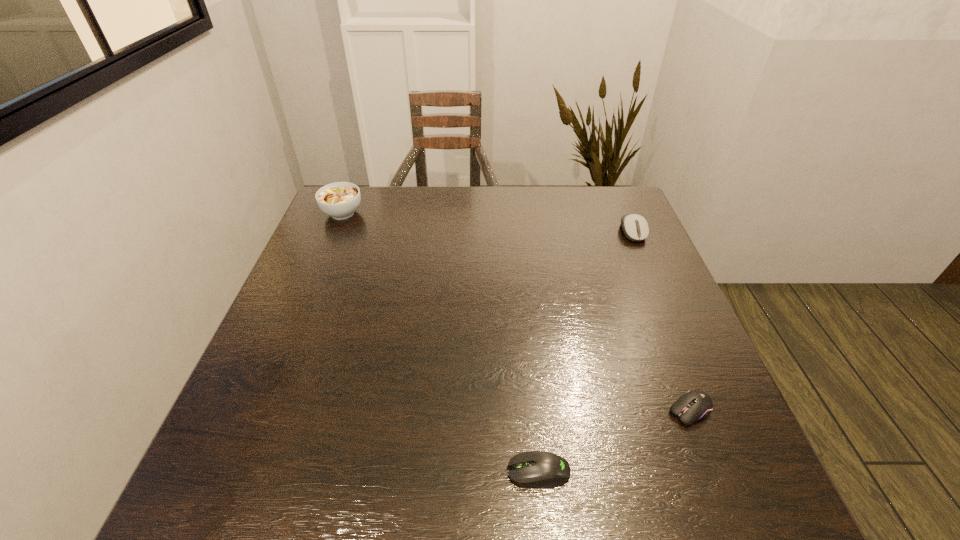
Where is `the tallest object`? the tallest object is located at coordinates (340, 200).

The height and width of the screenshot is (540, 960). Identify the location of the leftmost object. (340, 200).

You are a GUI agent. You are given a task and a screenshot of the screen. Output one action in this format:
    pyautogui.click(x=<x>, y=<y>)
    Task: Click on the third shortest object
    The width and height of the screenshot is (960, 540).
    Given the screenshot: What is the action you would take?
    pyautogui.click(x=635, y=227)

The height and width of the screenshot is (540, 960). I want to click on the farthest computer mouse, so click(635, 227).

Where is `the third farthest object`? The height and width of the screenshot is (540, 960). the third farthest object is located at coordinates (695, 405).

The height and width of the screenshot is (540, 960). What are the coordinates of `the third object from right to left` in the screenshot? It's located at (539, 469).

Identify the location of the leftmost computer mouse. (539, 469).

Where is `vacant space located 0.100m on the front of the soup bowl`? This screenshot has width=960, height=540. vacant space located 0.100m on the front of the soup bowl is located at coordinates (x=329, y=246).

Identify the location of free region located 0.100m on the wheel side of the third shortest object. This screenshot has height=540, width=960. [648, 267].

Find the location of a particular element. The image size is (960, 540). blank space located on the back of the second nearest object is located at coordinates (663, 343).